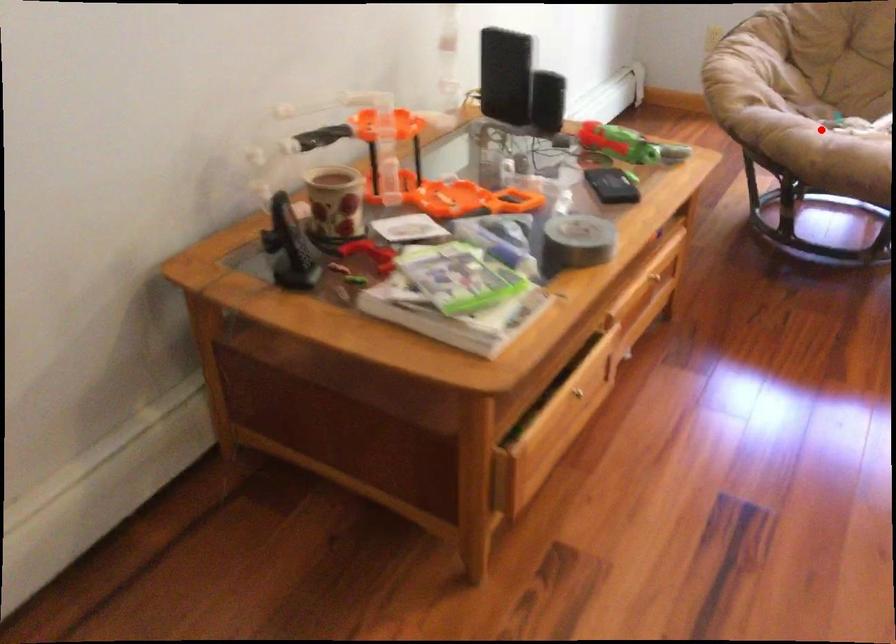
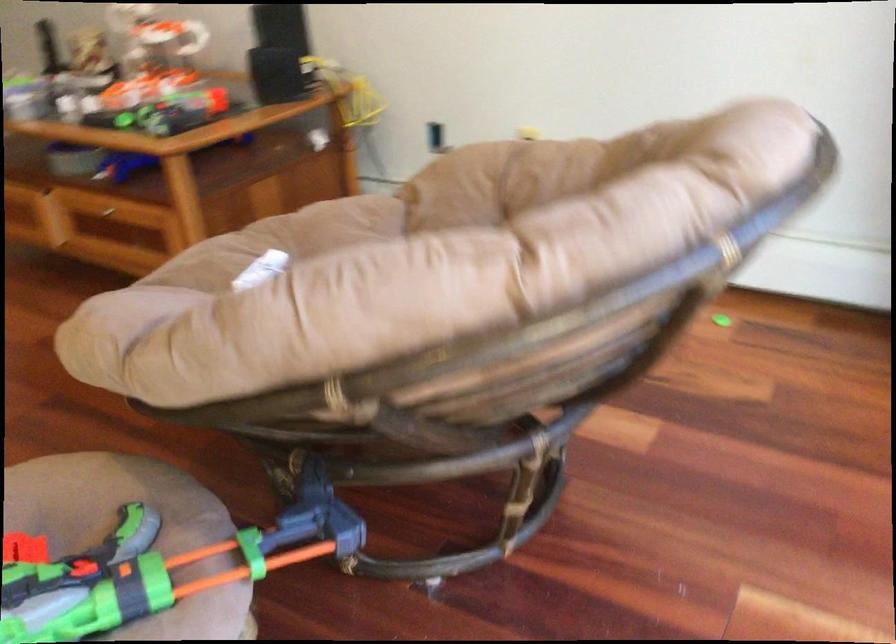
Question: I am providing you with two images of the same scene from different viewpoints. Given a red point in image1, look at the same physical point in image2. Is it:

Choices:
 (A) Closer to the viewpoint
 (B) Farther from the viewpoint

Answer: (A)